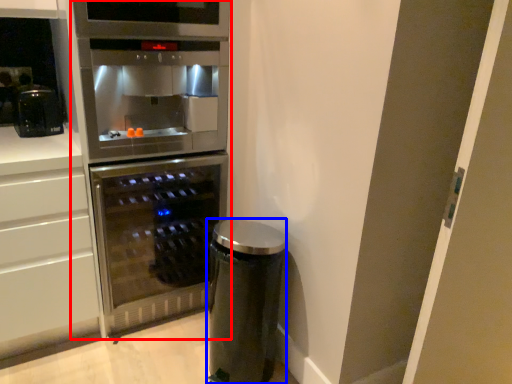
Question: Which of the following is the closest to the observer, fridge (highlighted by a red box) or appliance (highlighted by a blue box)?

Choices:
 (A) fridge
 (B) appliance

Answer: (A)